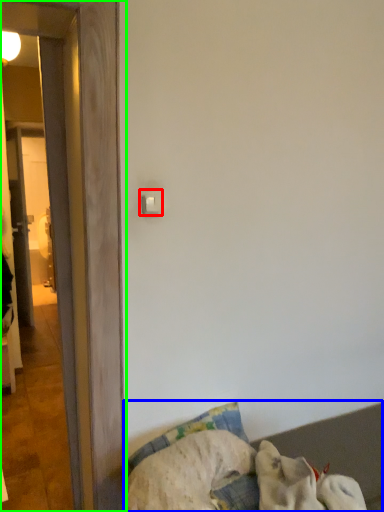
Question: Which is nearer to the light switch (highlighted by a red box)? furniture (highlighted by a blue box) or door (highlighted by a green box).

Choices:
 (A) furniture
 (B) door

Answer: (B)